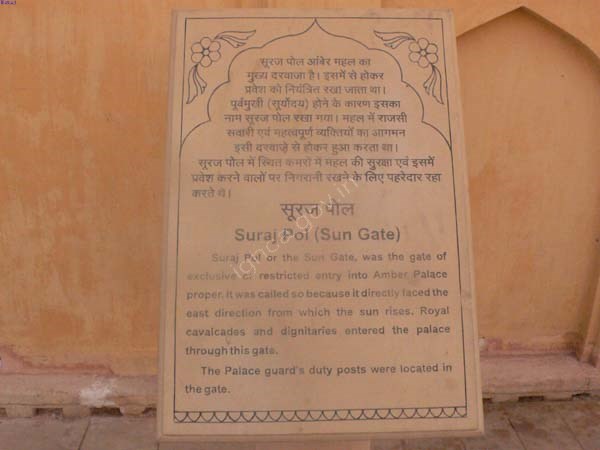
Find the location of `plaque is a pale rust brown color`. plaque is a pale rust brown color is located at coordinates (265, 192).